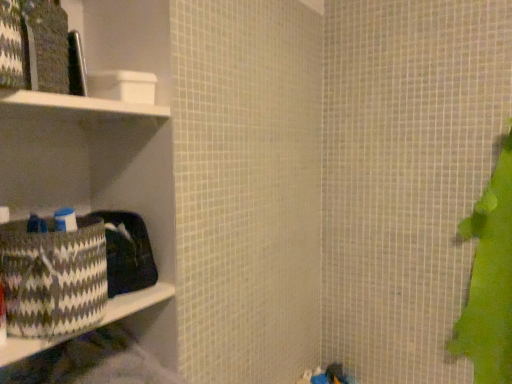
Question: Considering the relative sizes of patterned fabric basket at left and white matte cabinet at upper left in the image provided, is patterned fabric basket at left bigger than white matte cabinet at upper left?

Choices:
 (A) no
 (B) yes

Answer: (B)

Question: Is patterned fabric basket at left to the right of white matte cabinet at upper left from the viewer's perspective?

Choices:
 (A) no
 (B) yes

Answer: (A)

Question: Is patterned fabric basket at left not inside white matte cabinet at upper left?

Choices:
 (A) no
 (B) yes

Answer: (B)

Question: Would you consider patterned fabric basket at left to be distant from white matte cabinet at upper left?

Choices:
 (A) no
 (B) yes

Answer: (A)

Question: Is patterned fabric basket at left positioned in front of white matte cabinet at upper left?

Choices:
 (A) no
 (B) yes

Answer: (A)

Question: From the image's perspective, is white matte cabinet at upper left located above or below patterned fabric basket at left?

Choices:
 (A) below
 (B) above

Answer: (B)

Question: Considering their positions, is white matte cabinet at upper left located in front of or behind patterned fabric basket at left?

Choices:
 (A) front
 (B) behind

Answer: (A)

Question: In terms of height, does white matte cabinet at upper left look taller or shorter compared to patterned fabric basket at left?

Choices:
 (A) tall
 (B) short

Answer: (B)

Question: In terms of width, does white matte cabinet at upper left look wider or thinner when compared to patterned fabric basket at left?

Choices:
 (A) thin
 (B) wide

Answer: (A)

Question: Considering the relative positions of patterned woven basket at left and white matte cabinet at upper left in the image provided, is patterned woven basket at left to the left or to the right of white matte cabinet at upper left?

Choices:
 (A) left
 (B) right

Answer: (B)

Question: In terms of width, does patterned woven basket at left look wider or thinner when compared to white matte cabinet at upper left?

Choices:
 (A) wide
 (B) thin

Answer: (B)

Question: From the image's perspective, is patterned woven basket at left above or below white matte cabinet at upper left?

Choices:
 (A) below
 (B) above

Answer: (A)

Question: Would you say patterned woven basket at left is inside or outside white matte cabinet at upper left?

Choices:
 (A) inside
 (B) outside

Answer: (B)

Question: From a real-world perspective, is patterned fabric basket at left above or below patterned woven basket at left?

Choices:
 (A) below
 (B) above

Answer: (A)

Question: From the image's perspective, is patterned fabric basket at left located above or below patterned woven basket at left?

Choices:
 (A) above
 (B) below

Answer: (B)